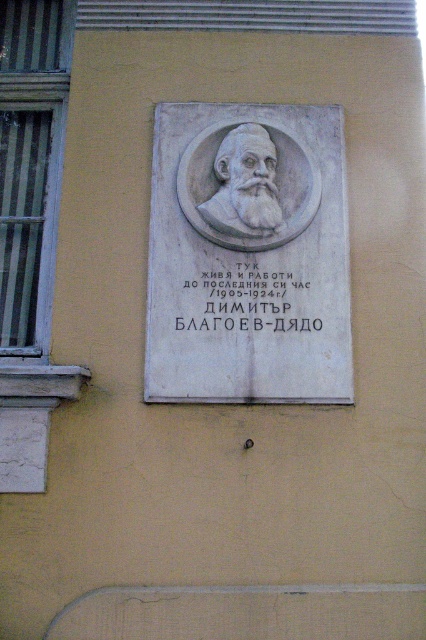
You are an architect designing a new building and want to replicate the placement of the white stone bust at center from the image. According to the coordinates provided, what are the exact coordinates where the bust should be placed on your design?

The white stone bust at center should be placed at the coordinates point (245, 186) as specified in the description.